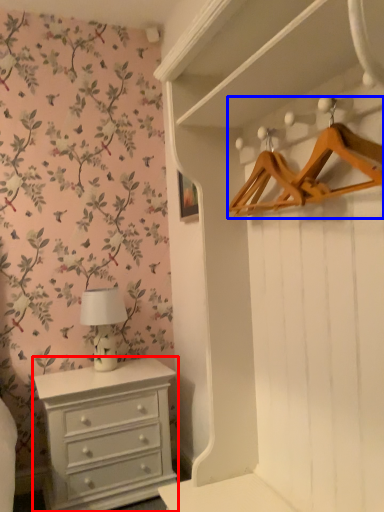
Question: Among these objects, which one is farthest to the camera, chest of drawers (highlighted by a red box) or hanger (highlighted by a blue box)?

Choices:
 (A) chest of drawers
 (B) hanger

Answer: (A)